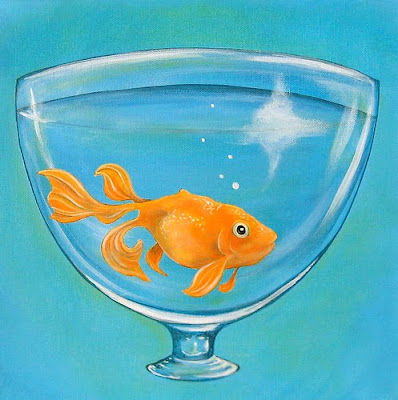
Find the location of `blue paint`. blue paint is located at coordinates (335, 29).